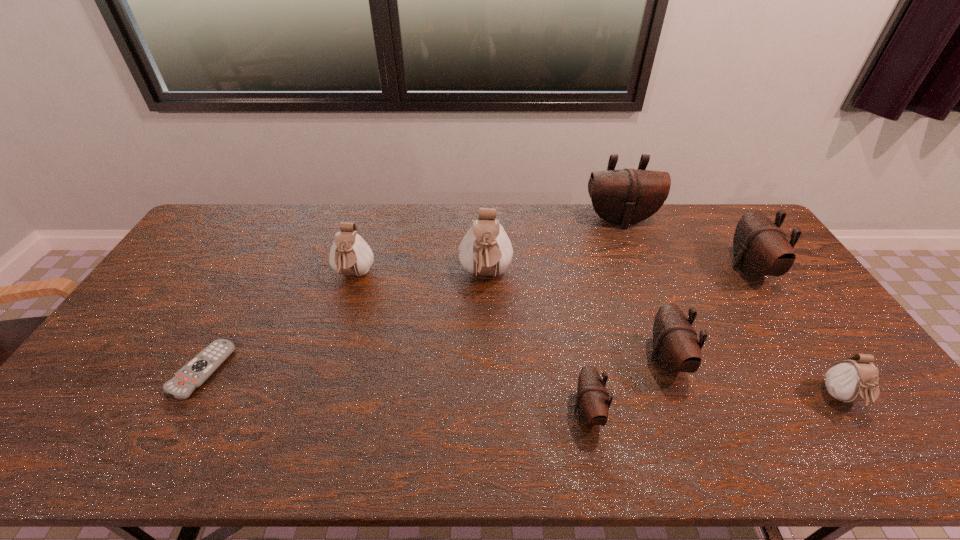
The height and width of the screenshot is (540, 960). Identify the location of vacant space at the far edge. (708, 234).

The image size is (960, 540). I want to click on vacant space at the left edge, so [x=190, y=274].

This screenshot has height=540, width=960. I want to click on vacant space at the near left corner of the desktop, so 97,458.

In the image, there is a desktop. Where is `vacant space at the far right corner`? The width and height of the screenshot is (960, 540). vacant space at the far right corner is located at coordinates (711, 218).

The image size is (960, 540). Find the location of `vacant area that lies between the smallest white pouch and the leftmost white pouch`. vacant area that lies between the smallest white pouch and the leftmost white pouch is located at coordinates click(598, 337).

Identify the location of unoccupied position between the remote control and the nearest white pouch. (522, 384).

At what (x,y) coordinates should I click in order to perform the action: click on free spot between the fourth object from left to right and the smallest white pouch. Please return your answer as a coordinate pair (x, y). Image resolution: width=960 pixels, height=540 pixels. Looking at the image, I should click on (715, 405).

At what (x,y) coordinates should I click in order to perform the action: click on free space between the smallest brown pouch and the farthest pouch. Please return your answer as a coordinate pair (x, y). The image size is (960, 540). Looking at the image, I should click on (604, 316).

Locate an element on the screen. This screenshot has width=960, height=540. free area in between the third biggest brown pouch and the rightmost brown pouch is located at coordinates (708, 314).

This screenshot has height=540, width=960. In order to click on vacant area that lies between the farthest object and the third pouch from left to right in this screenshot , I will do `click(604, 316)`.